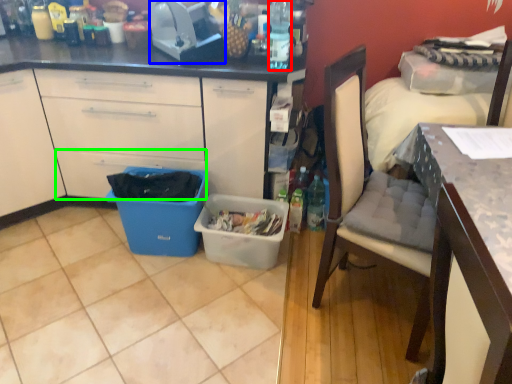
Question: Considering the real-world distances, which object is closest to bottle (highlighted by a red box)? toaster (highlighted by a blue box) or drawer (highlighted by a green box).

Choices:
 (A) toaster
 (B) drawer

Answer: (A)